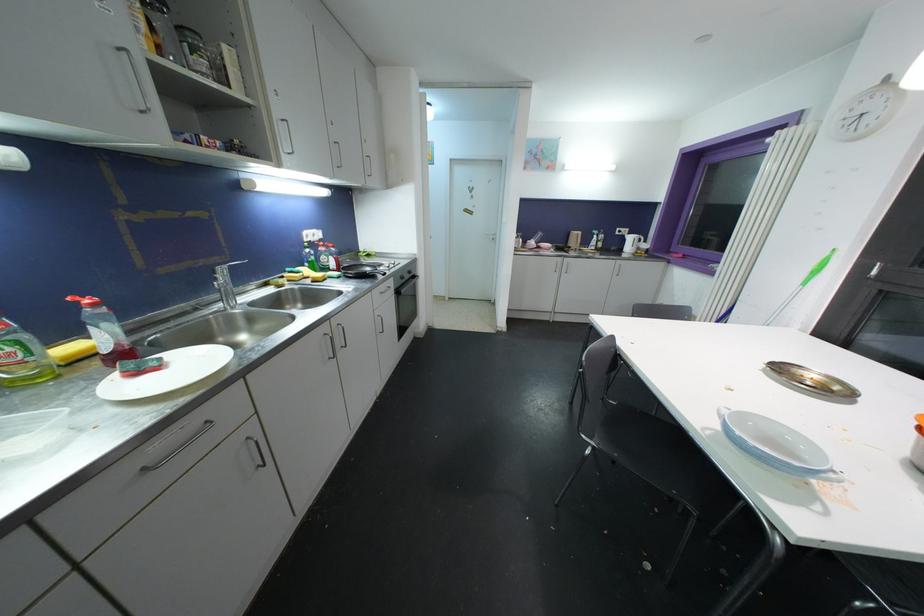
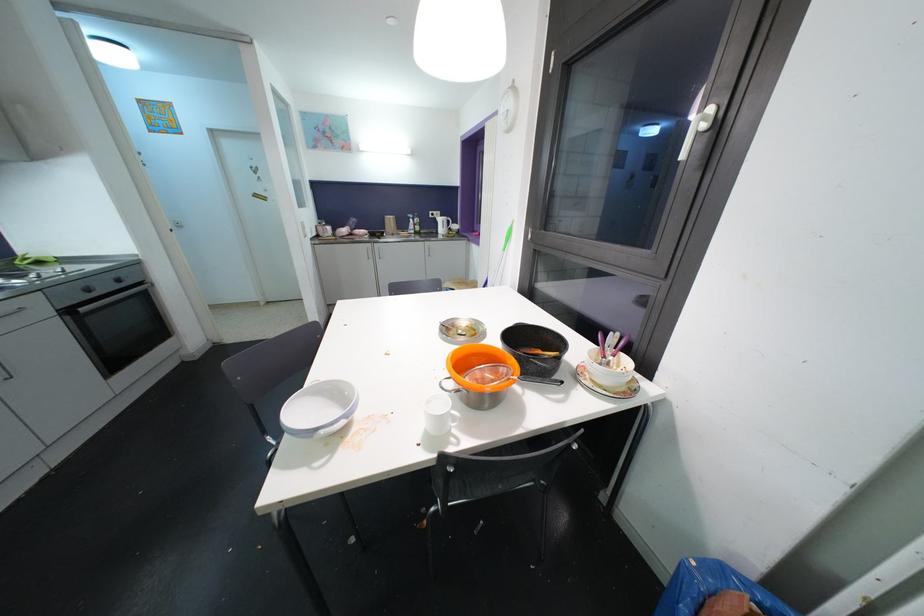
Locate, in the second image, the point that corresponds to pixel 634 241 in the first image.

(444, 223)